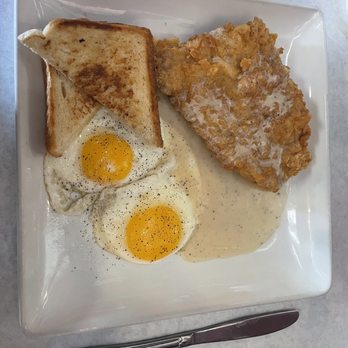
You are a GUI agent. You are given a task and a screenshot of the screen. Output one action in this format:
    pyautogui.click(x=<x>, y=<y>)
    Task: Click on the white paceline dish with shallow depth
    The height and width of the screenshot is (348, 348).
    Given the screenshot: What is the action you would take?
    pyautogui.click(x=291, y=272)